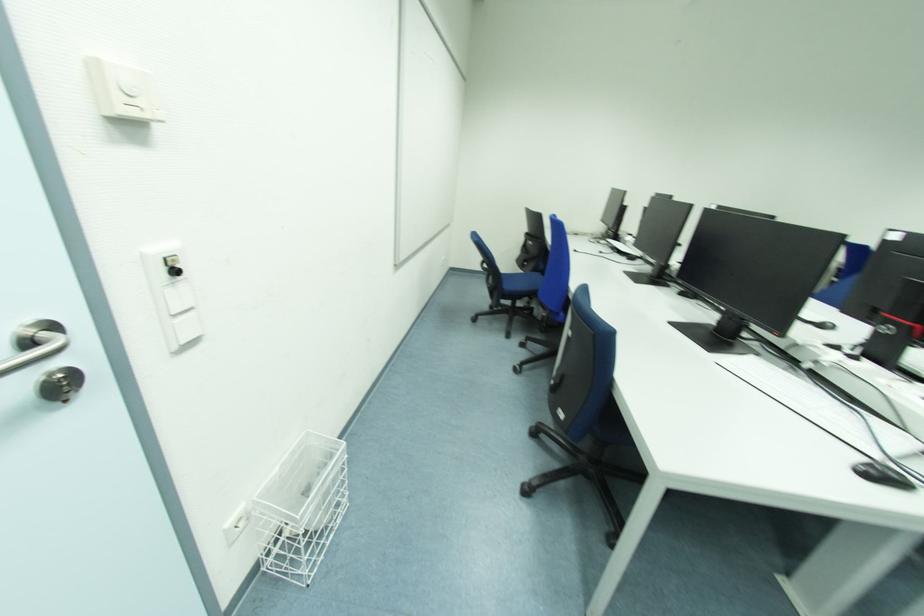
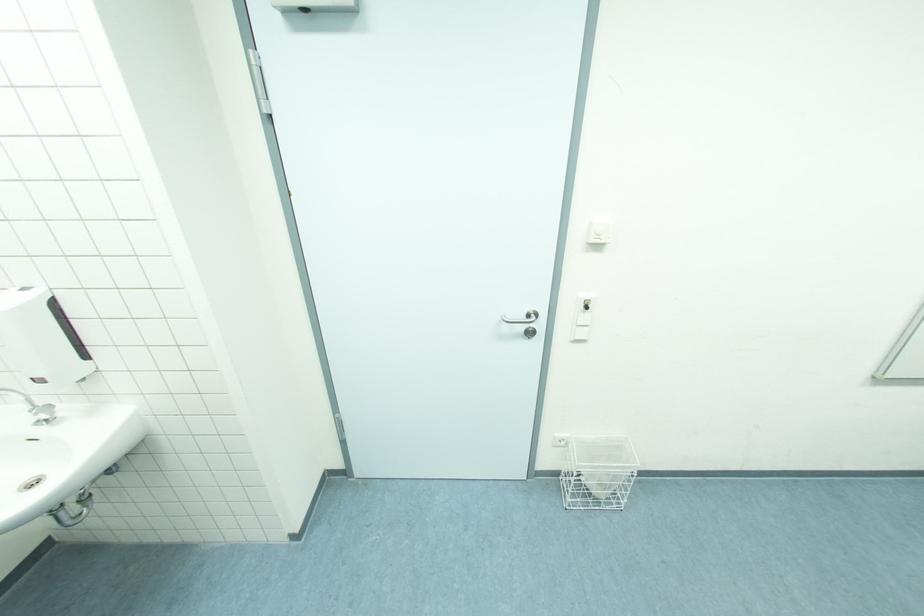
Locate, in the second image, the point that corresponds to point 261,564 in the first image.

(563, 472)